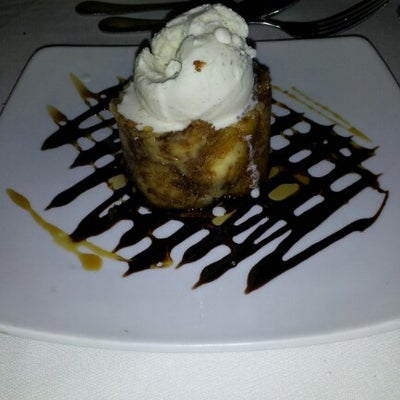
The width and height of the screenshot is (400, 400). In order to click on table to right of plate in this screenshot , I will do `click(389, 55)`.